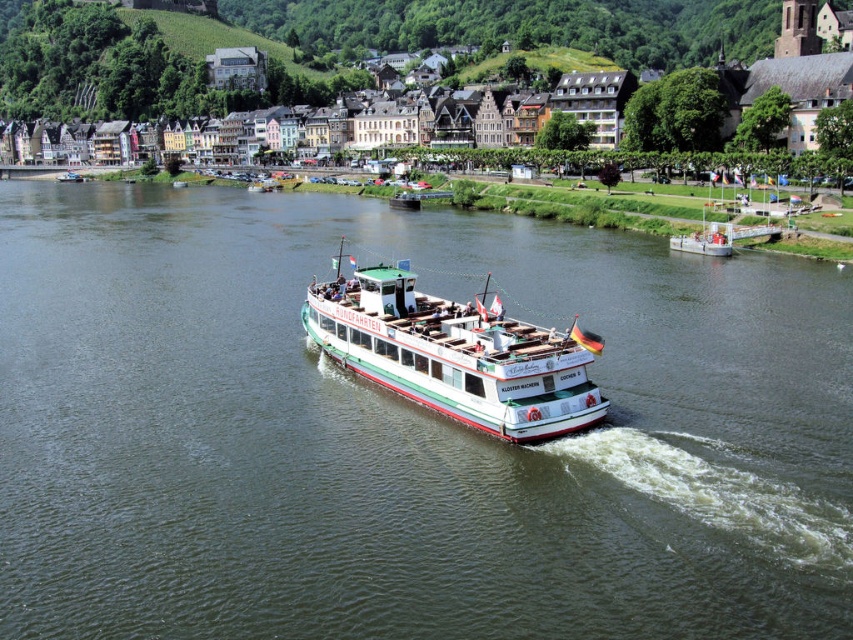
You are a tourist standing on the riverside and want to take a photo of the green matte boat at center. Where should you position yourself to capture the boat in the best possible view?

The green matte boat at center is located at point (404, 433), so you should position yourself directly in front of that coordinate to capture the boat in the best possible view.